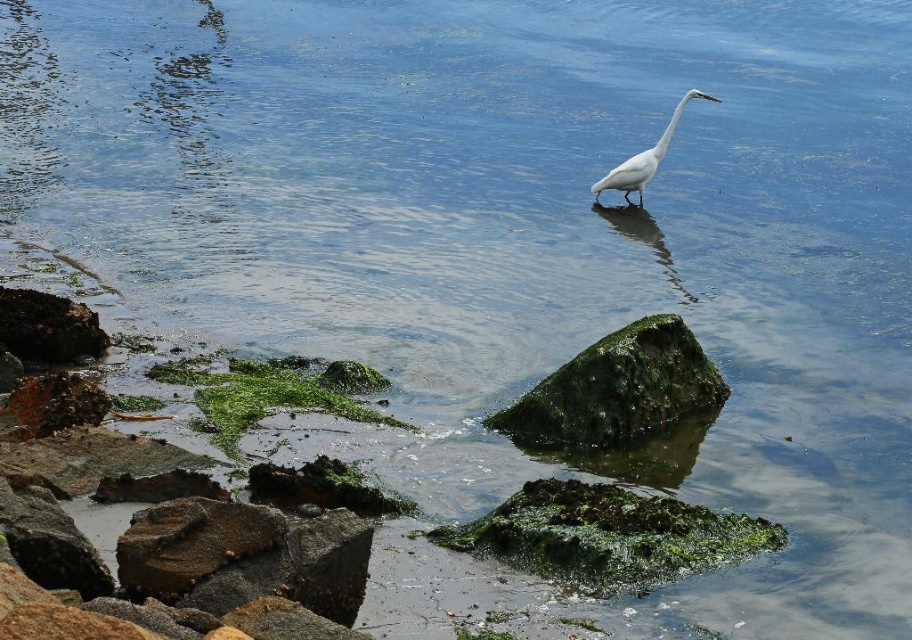
Question: Is green mossy rock at center to the left of green mossy algae at lower left from the viewer's perspective?

Choices:
 (A) yes
 (B) no

Answer: (B)

Question: Is green mossy rock at center wider than green mossy algae at lower left?

Choices:
 (A) no
 (B) yes

Answer: (A)

Question: Which is nearer to the white smooth bird at center?

Choices:
 (A) green mossy algae at lower left
 (B) green mossy rock at center

Answer: (B)

Question: Can you confirm if green mossy rock at center is thinner than green mossy algae at lower left?

Choices:
 (A) no
 (B) yes

Answer: (B)

Question: Which object is closer to the camera taking this photo?

Choices:
 (A) green mossy rock at lower center
 (B) green mossy rock at center
 (C) green mossy algae at lower left
 (D) white smooth bird at center

Answer: (A)

Question: Which of the following is the closest to the observer?

Choices:
 (A) green mossy algae at lower left
 (B) green mossy rock at center
 (C) white smooth bird at center
 (D) green mossy rock at lower center

Answer: (D)